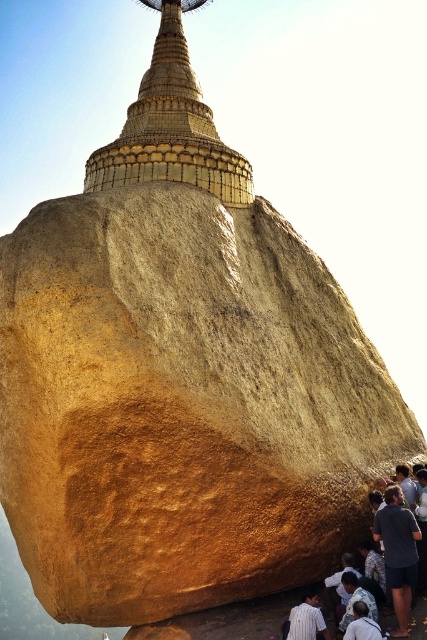
Does point (397, 614) come closer to viewer compared to point (354, 637)?

No, it is not.

Is dark blue shirt at lower right further to the viewer compared to white shirt at lower center?

Yes, dark blue shirt at lower right is further from the viewer.

Identify the location of dark blue shirt at lower right. This screenshot has width=427, height=640. (397, 552).

Which is in front, point (108, 160) or point (300, 609)?

Point (300, 609) is in front.

Is gold textured stupa at upper center taller than white striped shirt at lower center?

Yes, gold textured stupa at upper center is taller than white striped shirt at lower center.

You are a GUI agent. You are given a task and a screenshot of the screen. Output one action in this format:
    pyautogui.click(x=<x>, y=<y>)
    Task: Click on the gold textured stupa at upper center
    
    Given the screenshot: What is the action you would take?
    pyautogui.click(x=170, y=129)

Which of these two, white striped shirt at lower center or white shirt at lower center, stands shorter?

Standing shorter between the two is white shirt at lower center.

In the scene shown: Can you confirm if white striped shirt at lower center is wider than white shirt at lower center?

Yes, white striped shirt at lower center is wider than white shirt at lower center.

Find the location of a particular element. The width and height of the screenshot is (427, 640). white striped shirt at lower center is located at coordinates (307, 618).